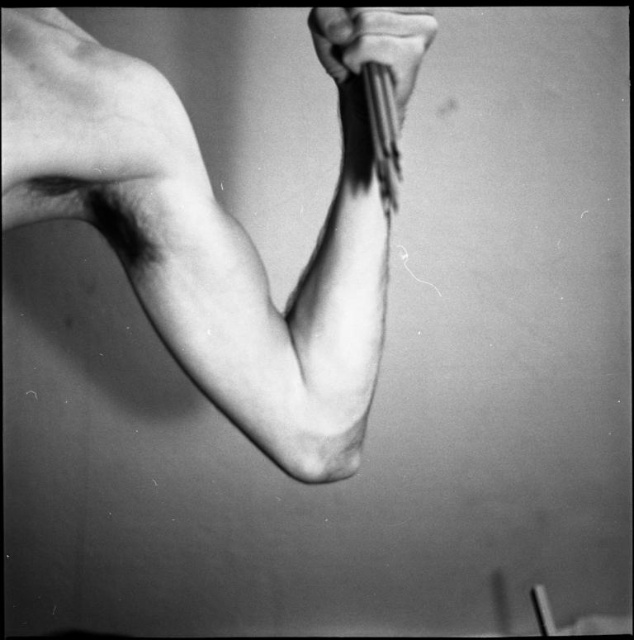
Which is in front, point (209, 355) or point (344, 28)?

Point (344, 28)

Measure the distance between point (145, 305) and camera.

They are 54.65 centimeters apart.

Locate an element on the screen. The width and height of the screenshot is (634, 640). smooth skin arm at center is located at coordinates (214, 225).

The image size is (634, 640). In order to click on smooth skin arm at center in this screenshot , I will do `click(214, 225)`.